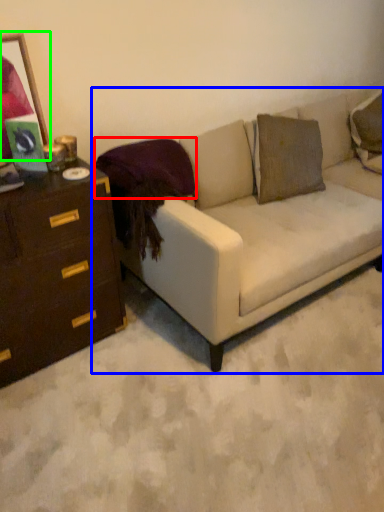
Question: Estimate the real-world distances between objects in this image. Which object is farther from pillow (highlighted by a red box), studio couch (highlighted by a blue box) or picture frame (highlighted by a green box)?

Choices:
 (A) studio couch
 (B) picture frame

Answer: (A)